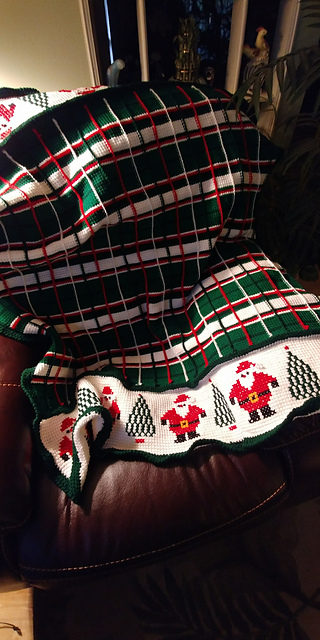
Find the location of a particular element. This screenshot has height=640, width=320. beige wall is located at coordinates (52, 24).